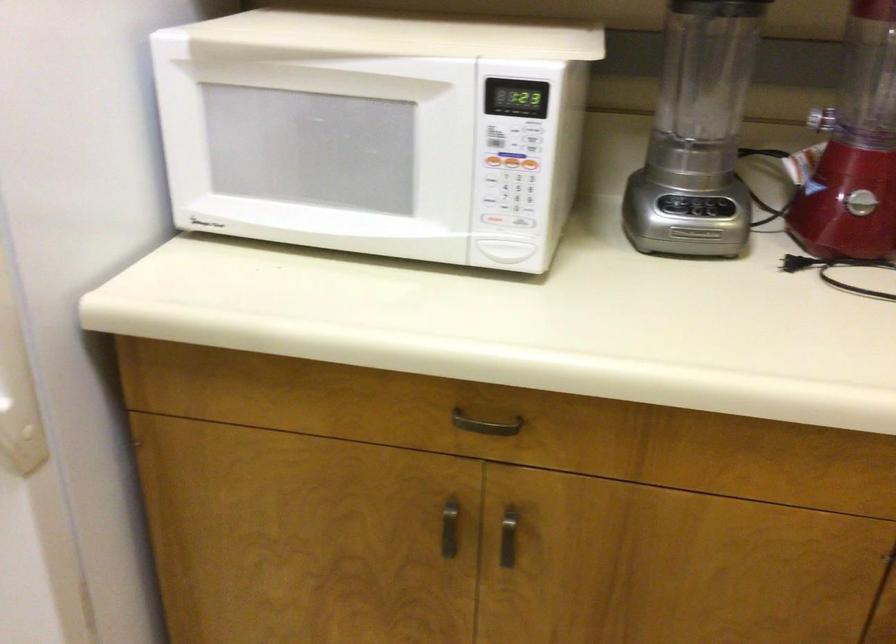
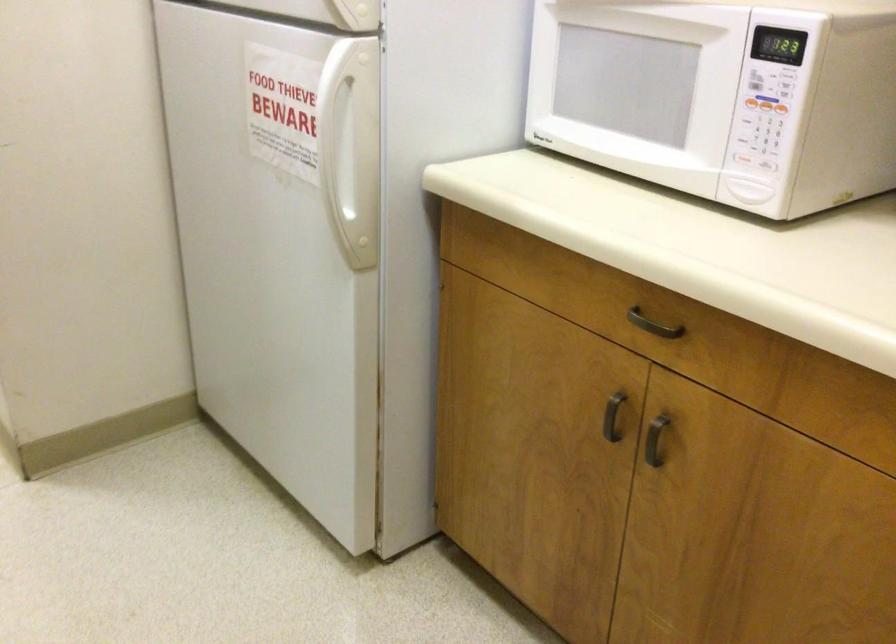
Question: I am providing you with two images of the same scene from different viewpoints. After the viewpoint changes to image2, which objects are now occluded?

Choices:
 (A) microwave door button
 (B) white refrigerator handle
 (C) metal cabinet handle
 (D) none of these

Answer: (D)